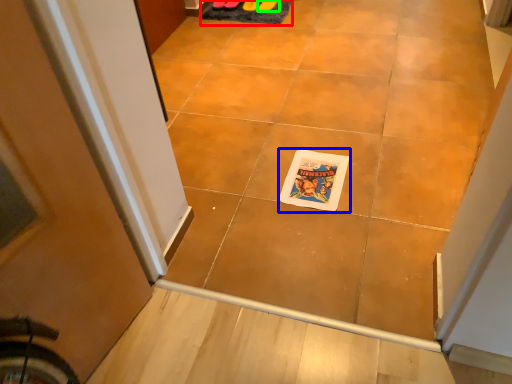
Question: Which object is positioned closest to doormat (highlighted by a red box)? Select from comic book character (highlighted by a blue box) and footwear (highlighted by a green box).

Choices:
 (A) comic book character
 (B) footwear

Answer: (B)